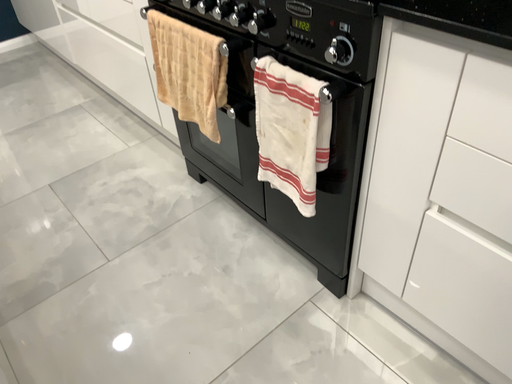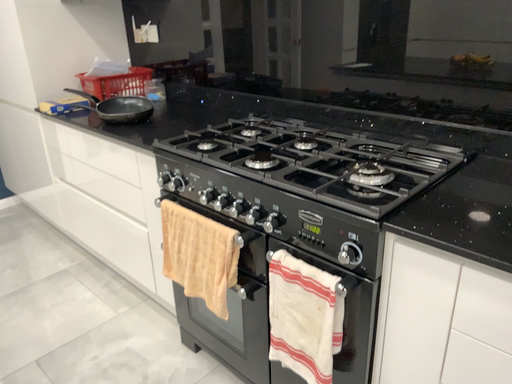
Question: Which way did the camera rotate in the video?

Choices:
 (A) rotated upward
 (B) rotated downward

Answer: (A)